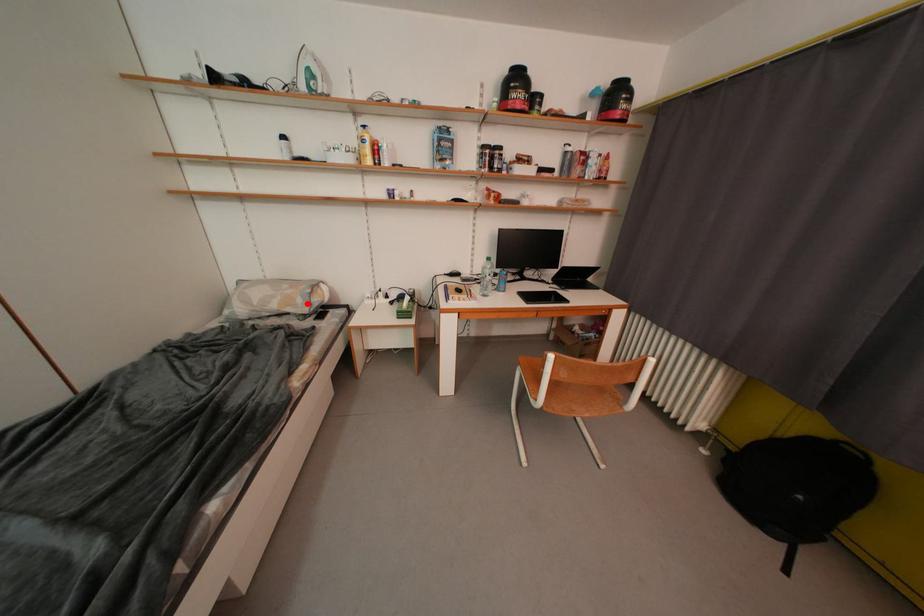
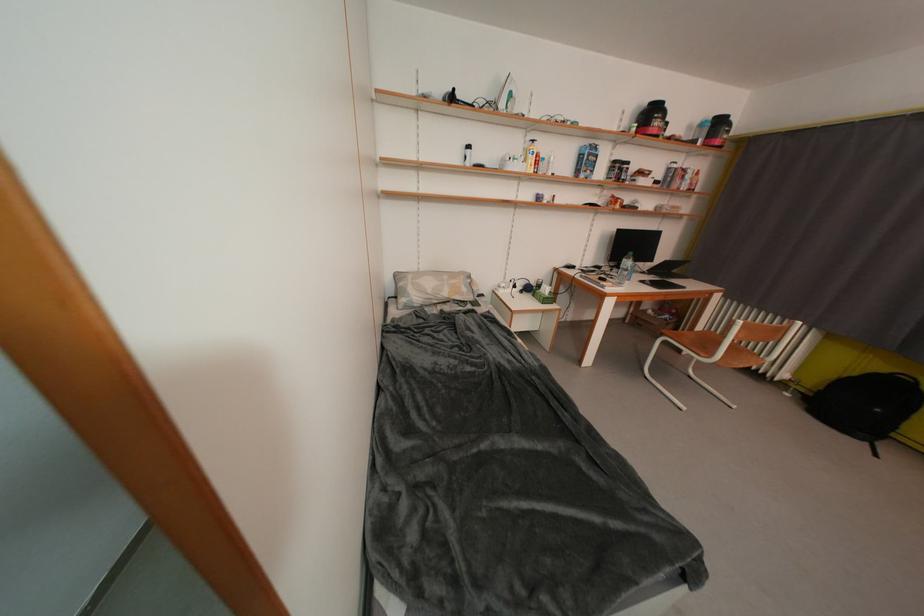
Question: I am providing you with two images of the same scene from different viewpoints. In image1, a red point is highlighted. Considering the same 3D point in image2, which of the following is correct?

Choices:
 (A) It is closer
 (B) It is farther

Answer: (B)